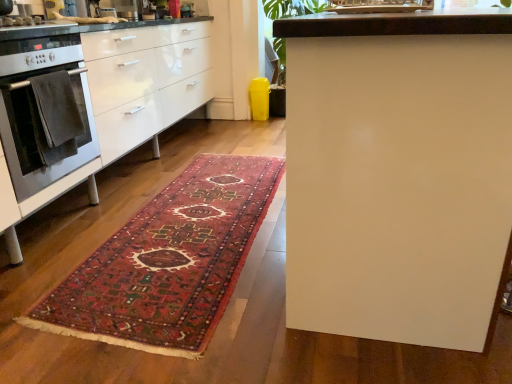
Measure the distance between stainless steel oven at left and camera.

A distance of 5.15 feet exists between stainless steel oven at left and camera.

The width and height of the screenshot is (512, 384). What do you see at coordinates (54, 116) in the screenshot?
I see `velvety dark gray towel at left` at bounding box center [54, 116].

What is the approximate height of velvety dark gray towel at left?

velvety dark gray towel at left is 15.23 inches in height.

This screenshot has width=512, height=384. I want to click on white glossy table at center, so click(x=398, y=173).

What do you see at coordinates (168, 262) in the screenshot? I see `carpeted rug at center` at bounding box center [168, 262].

At what (x,y) coordinates should I click in order to perform the action: click on stainless steel oven at left. Please return your answer as a coordinate pair (x, y). Looking at the image, I should click on (37, 110).

Considering the relative positions of white glossy table at center and velvety dark gray towel at left in the image provided, is white glossy table at center to the left or to the right of velvety dark gray towel at left?

Clearly, white glossy table at center is on the right of velvety dark gray towel at left in the image.

Considering the sizes of objects white glossy table at center and velvety dark gray towel at left in the image provided, who is bigger, white glossy table at center or velvety dark gray towel at left?

With larger size is white glossy table at center.

What's the angular difference between white glossy table at center and velvety dark gray towel at left's facing directions?

1.18 degrees separate the facing orientations of white glossy table at center and velvety dark gray towel at left.

Which of these two, white glossy table at center or velvety dark gray towel at left, stands taller?

With more height is white glossy table at center.

From the picture: Would you say white glossy table at center is inside or outside carpeted rug at center?

white glossy table at center lies outside carpeted rug at center.

Does point (322, 130) come farther from viewer compared to point (216, 286)?

No, it is in front of (216, 286).

Considering the sizes of objects white glossy table at center and carpeted rug at center in the image provided, who is wider, white glossy table at center or carpeted rug at center?

carpeted rug at center is wider.

Would you say white glossy table at center is a long distance from carpeted rug at center?

No.

Does velvety dark gray towel at left have a larger size compared to stainless steel oven at left?

Actually, velvety dark gray towel at left might be smaller than stainless steel oven at left.

Does point (29, 79) come farther from viewer compared to point (84, 145)?

No, (29, 79) is in front of (84, 145).

Looking at this image, who is shorter, velvety dark gray towel at left or stainless steel oven at left?

velvety dark gray towel at left.

Relative to carpeted rug at center, is stainless steel oven at left in front or behind?

stainless steel oven at left is positioned farther from the viewer than carpeted rug at center.

From the image's perspective, is stainless steel oven at left above carpeted rug at center?

Correct, stainless steel oven at left appears higher than carpeted rug at center in the image.

Choose the correct answer: Is stainless steel oven at left inside carpeted rug at center or outside it?

stainless steel oven at left is spatially situated outside carpeted rug at center.

Can you tell me how much velvety dark gray towel at left and carpeted rug at center differ in facing direction?

The facing directions of velvety dark gray towel at left and carpeted rug at center are 89.3 degrees apart.

Is velvety dark gray towel at left to the left of carpeted rug at center from the viewer's perspective?

Correct, you'll find velvety dark gray towel at left to the left of carpeted rug at center.

In the image, is velvety dark gray towel at left positioned in front of or behind carpeted rug at center?

Clearly, velvety dark gray towel at left is behind carpeted rug at center.

Consider the image. Which object is wider, velvety dark gray towel at left or carpeted rug at center?

carpeted rug at center is wider.

Is velvety dark gray towel at left with white glossy table at center?

No, velvety dark gray towel at left is not in contact with white glossy table at center.

Does point (49, 126) come in front of point (500, 259)?

No, (49, 126) is further to viewer.

Considering the positions of objects velvety dark gray towel at left and white glossy table at center in the image provided, who is behind, velvety dark gray towel at left or white glossy table at center?

velvety dark gray towel at left is more distant.

Looking at this image, which is closer, (66, 67) or (36, 87)?

Point (66, 67).

In the scene shown: From a real-world perspective, is stainless steel oven at left below velvety dark gray towel at left?

No, from a real-world perspective, stainless steel oven at left is not below velvety dark gray towel at left.

Can you confirm if stainless steel oven at left is positioned to the right of velvety dark gray towel at left?

No.

Measure the distance between stainless steel oven at left and velvety dark gray towel at left.

They are 7.81 centimeters apart.

Where is `table above the velvety dark gray towel at left (from the image's perspective)`? table above the velvety dark gray towel at left (from the image's perspective) is located at coordinates (398, 173).

The width and height of the screenshot is (512, 384). I want to click on mat below the white glossy table at center (from a real-world perspective), so click(x=168, y=262).

When comparing their distances from white glossy table at center, does velvety dark gray towel at left or stainless steel oven at left seem closer?

Based on the image, velvety dark gray towel at left appears to be nearer to white glossy table at center.

When comparing their distances from stainless steel oven at left, does white glossy table at center or carpeted rug at center seem closer?

The object closer to stainless steel oven at left is carpeted rug at center.

Looking at the image, which one is located further to stainless steel oven at left, carpeted rug at center or velvety dark gray towel at left?

Based on the image, carpeted rug at center appears to be further to stainless steel oven at left.

Which object lies nearer to the anchor point stainless steel oven at left, carpeted rug at center or white glossy table at center?

carpeted rug at center lies closer to stainless steel oven at left than the other object.

When comparing their distances from velvety dark gray towel at left, does carpeted rug at center or white glossy table at center seem closer?

carpeted rug at center is closer to velvety dark gray towel at left.

Which object lies further to the anchor point velvety dark gray towel at left, stainless steel oven at left or carpeted rug at center?

carpeted rug at center is further to velvety dark gray towel at left.

From the image, which object appears to be nearer to velvety dark gray towel at left, white glossy table at center or stainless steel oven at left?

stainless steel oven at left is positioned closer to the anchor velvety dark gray towel at left.

Considering their positions, is carpeted rug at center positioned further to white glossy table at center than velvety dark gray towel at left?

Among the two, velvety dark gray towel at left is located further to white glossy table at center.

This screenshot has width=512, height=384. I want to click on blanket between stainless steel oven at left and white glossy table at center in the horizontal direction, so click(x=54, y=116).

Where is `mat between velvety dark gray towel at left and white glossy table at center in the horizontal direction`? mat between velvety dark gray towel at left and white glossy table at center in the horizontal direction is located at coordinates (168, 262).

At what (x,y) coordinates should I click in order to perform the action: click on mat between stainless steel oven at left and white glossy table at center in the horizontal direction. Please return your answer as a coordinate pair (x, y). The height and width of the screenshot is (384, 512). Looking at the image, I should click on (168, 262).

Where is `blanket between stainless steel oven at left and carpeted rug at center in the horizontal direction`? blanket between stainless steel oven at left and carpeted rug at center in the horizontal direction is located at coordinates (54, 116).